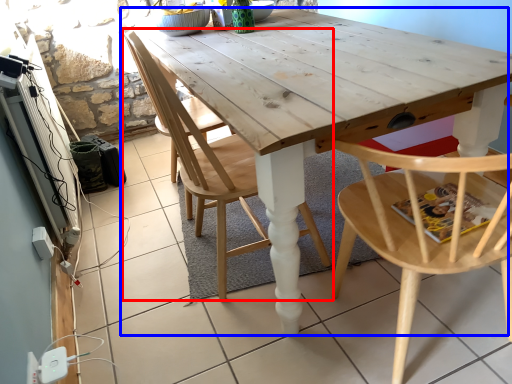
Question: Which of the following is the closest to the observer, chair (highlighted by a red box) or table (highlighted by a blue box)?

Choices:
 (A) chair
 (B) table

Answer: (B)